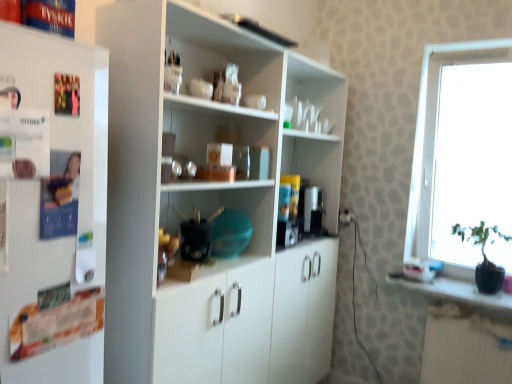
Question: Is matte plastic coffee machine at center spatially inside white matte refrigerator at left, or outside of it?

Choices:
 (A) inside
 (B) outside

Answer: (B)

Question: Is matte plastic coffee machine at center to the left or to the right of white matte refrigerator at left in the image?

Choices:
 (A) right
 (B) left

Answer: (A)

Question: Considering the real-world distances, which object is closest to the transparent glass window at right?

Choices:
 (A) black glossy pot at right
 (B) white matte refrigerator at left
 (C) matte plastic coffee machine at center
 (D) white matte cupboard at center

Answer: (A)

Question: Considering the real-world distances, which object is closest to the white matte refrigerator at left?

Choices:
 (A) black glossy pot at right
 (B) white matte cupboard at center
 (C) matte plastic coffee machine at center
 (D) transparent glass window at right

Answer: (B)